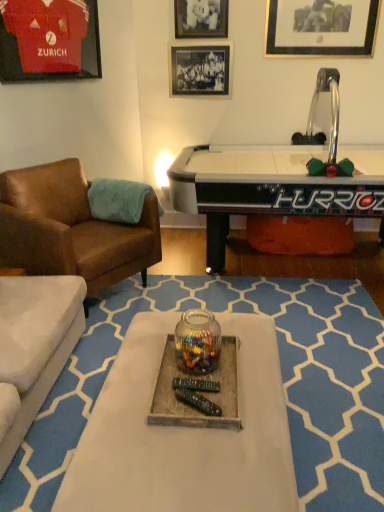
Where is `free point in front of black plastic remote control at center, arranged as the second remote control when viewed from the back`? This screenshot has width=384, height=512. free point in front of black plastic remote control at center, arranged as the second remote control when viewed from the back is located at coordinates (197, 424).